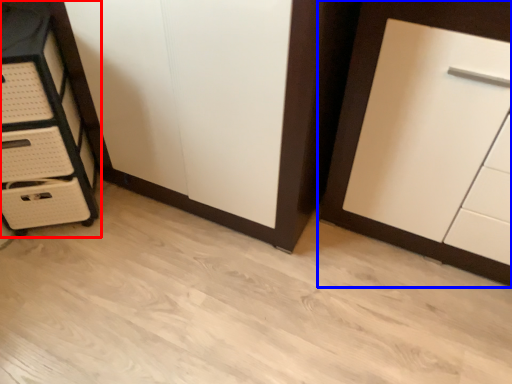
Question: Which object appears farthest to the camera in this image, chest of drawers (highlighted by a red box) or cupboard (highlighted by a blue box)?

Choices:
 (A) chest of drawers
 (B) cupboard

Answer: (A)